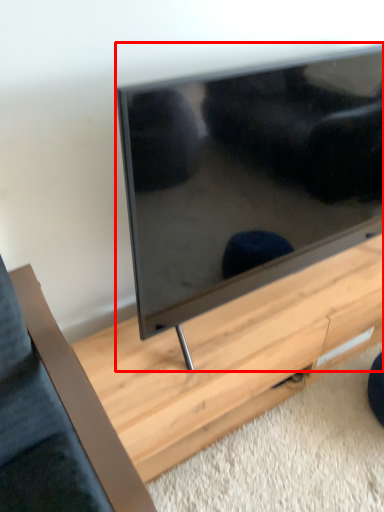
Question: From the image's perspective, where is television (annotated by the red box) located relative to table?

Choices:
 (A) below
 (B) above

Answer: (B)